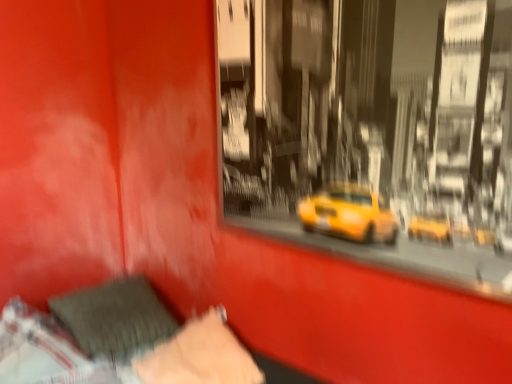
Question: Can you confirm if velvety gray pillow at lower left, positioned as the first pillow in left-to-right order, is taller than velvety black pillow at lower left, marked as the 2th pillow in a left-to-right arrangement?

Choices:
 (A) no
 (B) yes

Answer: (A)

Question: Does velvety gray pillow at lower left, positioned as the first pillow in left-to-right order, have a greater width compared to velvety black pillow at lower left, positioned as the first pillow in right-to-left order?

Choices:
 (A) no
 (B) yes

Answer: (A)

Question: Could you tell me if velvety gray pillow at lower left, positioned as the first pillow in left-to-right order, is facing velvety black pillow at lower left, positioned as the first pillow in right-to-left order?

Choices:
 (A) yes
 (B) no

Answer: (B)

Question: Can you confirm if velvety gray pillow at lower left, the second pillow in the right-to-left sequence, is shorter than velvety black pillow at lower left, marked as the 2th pillow in a left-to-right arrangement?

Choices:
 (A) yes
 (B) no

Answer: (A)

Question: Does velvety gray pillow at lower left, the second pillow in the right-to-left sequence, contain velvety black pillow at lower left, marked as the 2th pillow in a left-to-right arrangement?

Choices:
 (A) no
 (B) yes

Answer: (A)

Question: Is velvety gray pillow at lower left, positioned as the first pillow in left-to-right order, bigger than velvety black pillow at lower left, positioned as the first pillow in right-to-left order?

Choices:
 (A) yes
 (B) no

Answer: (A)

Question: Considering the relative sizes of velvety black pillow at lower left, positioned as the first pillow in right-to-left order, and velvety gray pillow at lower left, the second pillow in the right-to-left sequence, in the image provided, is velvety black pillow at lower left, positioned as the first pillow in right-to-left order, bigger than velvety gray pillow at lower left, the second pillow in the right-to-left sequence,?

Choices:
 (A) no
 (B) yes

Answer: (A)

Question: From the image's perspective, would you say velvety black pillow at lower left, marked as the 2th pillow in a left-to-right arrangement, is positioned over velvety gray pillow at lower left, positioned as the first pillow in left-to-right order?

Choices:
 (A) yes
 (B) no

Answer: (B)

Question: Is velvety black pillow at lower left, positioned as the first pillow in right-to-left order, positioned far away from velvety gray pillow at lower left, positioned as the first pillow in left-to-right order?

Choices:
 (A) no
 (B) yes

Answer: (A)

Question: Does velvety black pillow at lower left, positioned as the first pillow in right-to-left order, turn towards velvety gray pillow at lower left, positioned as the first pillow in left-to-right order?

Choices:
 (A) yes
 (B) no

Answer: (B)

Question: Could velvety gray pillow at lower left, the second pillow in the right-to-left sequence, be considered to be inside velvety black pillow at lower left, marked as the 2th pillow in a left-to-right arrangement?

Choices:
 (A) no
 (B) yes

Answer: (A)

Question: From a real-world perspective, is velvety black pillow at lower left, marked as the 2th pillow in a left-to-right arrangement, positioned under velvety gray pillow at lower left, positioned as the first pillow in left-to-right order, based on gravity?

Choices:
 (A) no
 (B) yes

Answer: (B)

Question: From a real-world perspective, is velvet-like gray pillow at lower left physically below velvety gray pillow at lower left, positioned as the first pillow in left-to-right order?

Choices:
 (A) no
 (B) yes

Answer: (B)